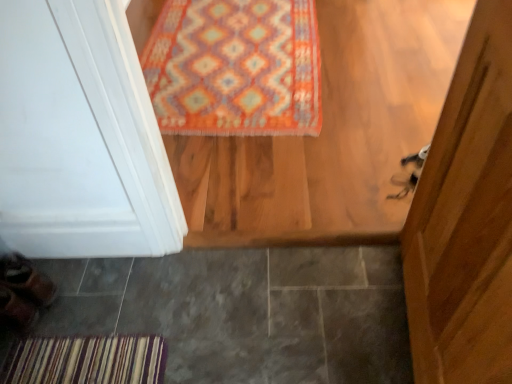
Image resolution: width=512 pixels, height=384 pixels. Find the location of `gray tile at lower left`. gray tile at lower left is located at coordinates (274, 314).

What do you see at coordinates (274, 314) in the screenshot? The image size is (512, 384). I see `gray tile at lower left` at bounding box center [274, 314].

You are a GUI agent. You are given a task and a screenshot of the screen. Output one action in this format:
    pyautogui.click(x=<x>, y=<y>)
    Task: Click on the multicolored woven rug at upper center
    The width and height of the screenshot is (512, 384).
    Given the screenshot: What is the action you would take?
    pyautogui.click(x=234, y=67)

This screenshot has height=384, width=512. In order to click on gray tile at lower left in this screenshot , I will do `click(274, 314)`.

Is gray tile at lower left oriented away from multicolored woven rug at upper center?

No, gray tile at lower left's orientation is not away from multicolored woven rug at upper center.

Who is smaller, gray tile at lower left or multicolored woven rug at upper center?

Smaller between the two is gray tile at lower left.

Who is more distant, gray tile at lower left or multicolored woven rug at upper center?

multicolored woven rug at upper center is more distant.

Who is shorter, gray tile at lower left or multicolored woven rug at upper center?

Standing shorter between the two is gray tile at lower left.

Can you tell me how much gray tile at lower left and brown leather shoe at lower left, the second shoe from the bottom, differ in facing direction?

gray tile at lower left and brown leather shoe at lower left, the second shoe from the bottom, are facing 166 degrees away from each other.

Considering the relative sizes of gray tile at lower left and brown leather shoe at lower left, the second shoe from the bottom, in the image provided, is gray tile at lower left shorter than brown leather shoe at lower left, the second shoe from the bottom,?

Correct, gray tile at lower left is not as tall as brown leather shoe at lower left, the second shoe from the bottom.

From the image's perspective, would you say gray tile at lower left is positioned over brown leather shoe at lower left, which is the first shoe from top to bottom?

No.

Between point (293, 339) and point (0, 270), which one is positioned behind?

The point (0, 270) is more distant.

From a real-world perspective, who is located lower, multicolored woven rug at upper center or brown leather shoe at lower left, which is the first shoe from top to bottom?

multicolored woven rug at upper center.

Between multicolored woven rug at upper center and brown leather shoe at lower left, which is the first shoe from top to bottom, which one has smaller width?

Thinner between the two is brown leather shoe at lower left, which is the first shoe from top to bottom.

From the image's perspective, is multicolored woven rug at upper center positioned above or below brown leather shoe at lower left, which is the first shoe from top to bottom?

multicolored woven rug at upper center is above brown leather shoe at lower left, which is the first shoe from top to bottom.

Can you confirm if multicolored woven rug at upper center is positioned to the left of brown leather shoe at lower left, the second shoe from the bottom?

No.

You are a GUI agent. You are given a task and a screenshot of the screen. Output one action in this format:
    pyautogui.click(x=<x>, y=<y>)
    Task: Click on the tile located in front of the multicolored woven rug at upper center
    The image size is (512, 384).
    Given the screenshot: What is the action you would take?
    pyautogui.click(x=274, y=314)

Between multicolored woven rug at upper center and gray tile at lower left, which one appears on the left side from the viewer's perspective?

Positioned to the left is gray tile at lower left.

Is multicolored woven rug at upper center shorter than gray tile at lower left?

No.

Is multicolored woven rug at upper center closer to camera compared to gray tile at lower left?

No, multicolored woven rug at upper center is further to the viewer.

Considering the sizes of objects leather brown shoe at lower left, which is the second shoe from top to bottom, and brown leather shoe at lower left, which is the first shoe from top to bottom, in the image provided, who is smaller, leather brown shoe at lower left, which is the second shoe from top to bottom, or brown leather shoe at lower left, which is the first shoe from top to bottom,?

leather brown shoe at lower left, which is the second shoe from top to bottom.

From the image's perspective, which is below, leather brown shoe at lower left, the 1th shoe ordered from the bottom, or brown leather shoe at lower left, which is the first shoe from top to bottom?

leather brown shoe at lower left, the 1th shoe ordered from the bottom, is shown below in the image.

From a real-world perspective, who is located lower, leather brown shoe at lower left, the 1th shoe ordered from the bottom, or brown leather shoe at lower left, the second shoe from the bottom?

brown leather shoe at lower left, the second shoe from the bottom, is physically lower.

Starting from the gray tile at lower left, which shoe is the 1st one behind? Please provide its 2D coordinates.

[(16, 311)]

Which is closer, (x=232, y=264) or (x=17, y=304)?

Point (x=232, y=264) is farther from the camera than point (x=17, y=304).

Between gray tile at lower left and leather brown shoe at lower left, which is the second shoe from top to bottom, which one appears on the left side from the viewer's perspective?

leather brown shoe at lower left, which is the second shoe from top to bottom, is more to the left.

Are gray tile at lower left and leather brown shoe at lower left, which is the second shoe from top to bottom, far apart?

Actually, gray tile at lower left and leather brown shoe at lower left, which is the second shoe from top to bottom, are a little close together.

From the image's perspective, which one is positioned higher, leather brown shoe at lower left, which is the second shoe from top to bottom, or gray tile at lower left?

leather brown shoe at lower left, which is the second shoe from top to bottom.

In the scene shown: In terms of height, does leather brown shoe at lower left, which is the second shoe from top to bottom, look taller or shorter compared to gray tile at lower left?

Considering their sizes, leather brown shoe at lower left, which is the second shoe from top to bottom, has more height than gray tile at lower left.

Is leather brown shoe at lower left, which is the second shoe from top to bottom, bigger than gray tile at lower left?

No, leather brown shoe at lower left, which is the second shoe from top to bottom, is not bigger than gray tile at lower left.

Identify the location of mat that is behind the gray tile at lower left. Image resolution: width=512 pixels, height=384 pixels. (234, 67).

Identify the location of tile below the brown leather shoe at lower left, the second shoe from the bottom (from a real-world perspective). This screenshot has height=384, width=512. (274, 314).

In the scene shown: From the image, which object appears to be nearer to leather brown shoe at lower left, the 1th shoe ordered from the bottom, multicolored woven rug at upper center or gray tile at lower left?

The object closer to leather brown shoe at lower left, the 1th shoe ordered from the bottom, is gray tile at lower left.

Estimate the real-world distances between objects in this image. Which object is closer to multicolored woven rug at upper center, leather brown shoe at lower left, which is the second shoe from top to bottom, or brown leather shoe at lower left, which is the first shoe from top to bottom?

brown leather shoe at lower left, which is the first shoe from top to bottom.

In the scene shown: Estimate the real-world distances between objects in this image. Which object is further from gray tile at lower left, brown leather shoe at lower left, the second shoe from the bottom, or multicolored woven rug at upper center?

multicolored woven rug at upper center lies further to gray tile at lower left than the other object.

From the image, which object appears to be farther from leather brown shoe at lower left, which is the second shoe from top to bottom, brown leather shoe at lower left, the second shoe from the bottom, or gray tile at lower left?

gray tile at lower left lies further to leather brown shoe at lower left, which is the second shoe from top to bottom, than the other object.

Looking at the image, which one is located closer to multicolored woven rug at upper center, gray tile at lower left or leather brown shoe at lower left, the 1th shoe ordered from the bottom?

The object closer to multicolored woven rug at upper center is gray tile at lower left.

Based on the photo, which object lies further to the anchor point brown leather shoe at lower left, the second shoe from the bottom, multicolored woven rug at upper center or leather brown shoe at lower left, the 1th shoe ordered from the bottom?

Among the two, multicolored woven rug at upper center is located further to brown leather shoe at lower left, the second shoe from the bottom.

Which object lies nearer to the anchor point leather brown shoe at lower left, the 1th shoe ordered from the bottom, brown leather shoe at lower left, which is the first shoe from top to bottom, or multicolored woven rug at upper center?

brown leather shoe at lower left, which is the first shoe from top to bottom, is positioned closer to the anchor leather brown shoe at lower left, the 1th shoe ordered from the bottom.

From the image, which object appears to be nearer to leather brown shoe at lower left, the 1th shoe ordered from the bottom, gray tile at lower left or brown leather shoe at lower left, the second shoe from the bottom?

brown leather shoe at lower left, the second shoe from the bottom, is closer to leather brown shoe at lower left, the 1th shoe ordered from the bottom.

The height and width of the screenshot is (384, 512). I want to click on shoe located between leather brown shoe at lower left, which is the second shoe from top to bottom, and gray tile at lower left in the left-right direction, so click(26, 279).

Locate an element on the screen. shoe that lies between multicolored woven rug at upper center and leather brown shoe at lower left, which is the second shoe from top to bottom, from top to bottom is located at coordinates (26, 279).